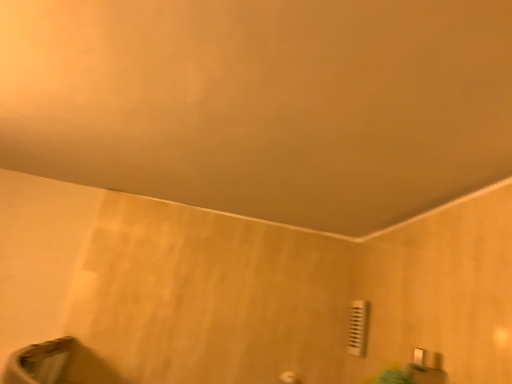
I want to click on white plastic light switch at lower right, so [357, 327].

What do you see at coordinates (357, 327) in the screenshot? Image resolution: width=512 pixels, height=384 pixels. I see `white plastic light switch at lower right` at bounding box center [357, 327].

Find the location of a particular element. The height and width of the screenshot is (384, 512). white plastic light switch at lower right is located at coordinates (357, 327).